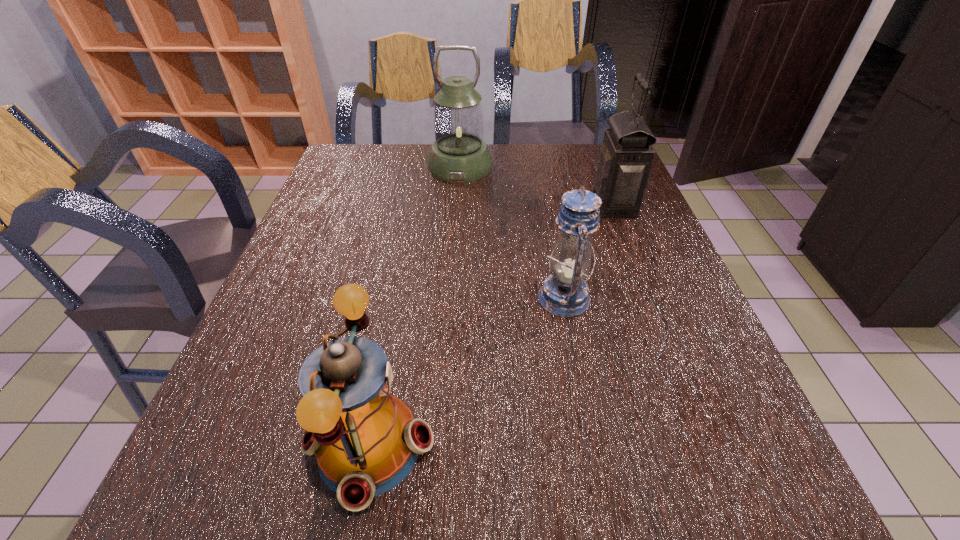
Where is `vacant space at the right edge of the desktop`? Image resolution: width=960 pixels, height=540 pixels. vacant space at the right edge of the desktop is located at coordinates (642, 337).

Locate an element on the screen. The height and width of the screenshot is (540, 960). free location at the far left corner of the desktop is located at coordinates click(x=346, y=158).

The image size is (960, 540). Find the location of `vacant region at the far right corner of the desktop`. vacant region at the far right corner of the desktop is located at coordinates click(x=578, y=144).

Where is `free location at the near right corner of the desktop`? The height and width of the screenshot is (540, 960). free location at the near right corner of the desktop is located at coordinates (x=749, y=517).

Find the location of a particular element. The height and width of the screenshot is (540, 960). free spot between the nearest lantern and the farthest lantern is located at coordinates [415, 306].

The width and height of the screenshot is (960, 540). I want to click on unoccupied area between the third nearest object and the farthest object, so click(x=537, y=185).

Identify the location of vacant region between the second farthest object and the farthest lantern. (537, 185).

At what (x,y) coordinates should I click in order to perform the action: click on free space between the nearest lantern and the third farthest lantern. Please return your answer as a coordinate pair (x, y). This screenshot has height=540, width=960. Looking at the image, I should click on (467, 372).

Find the location of a particular element. The height and width of the screenshot is (540, 960). vacant space in between the nearest object and the farthest object is located at coordinates (415, 306).

The width and height of the screenshot is (960, 540). What are the coordinates of `free space between the nearest object and the rightmost lantern` in the screenshot? It's located at (492, 325).